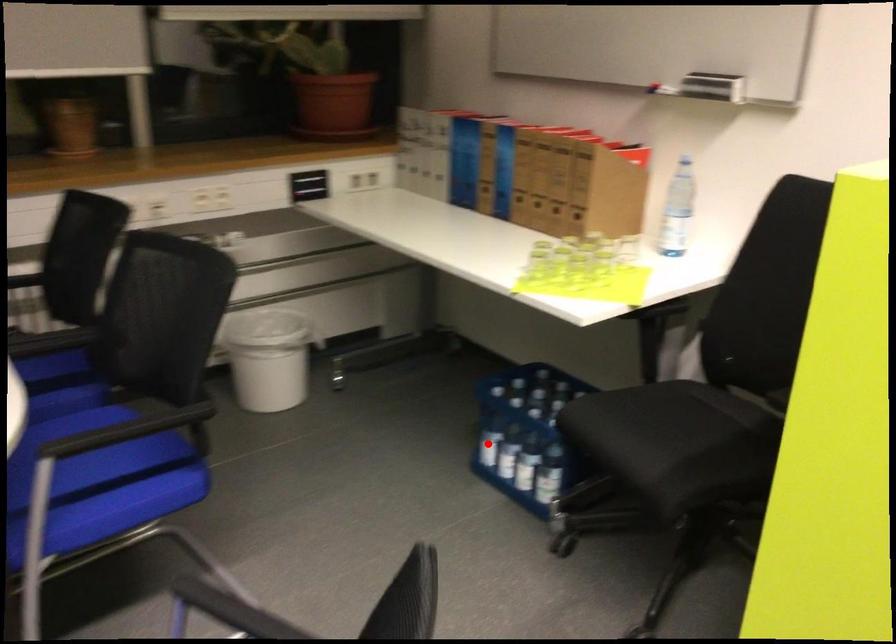
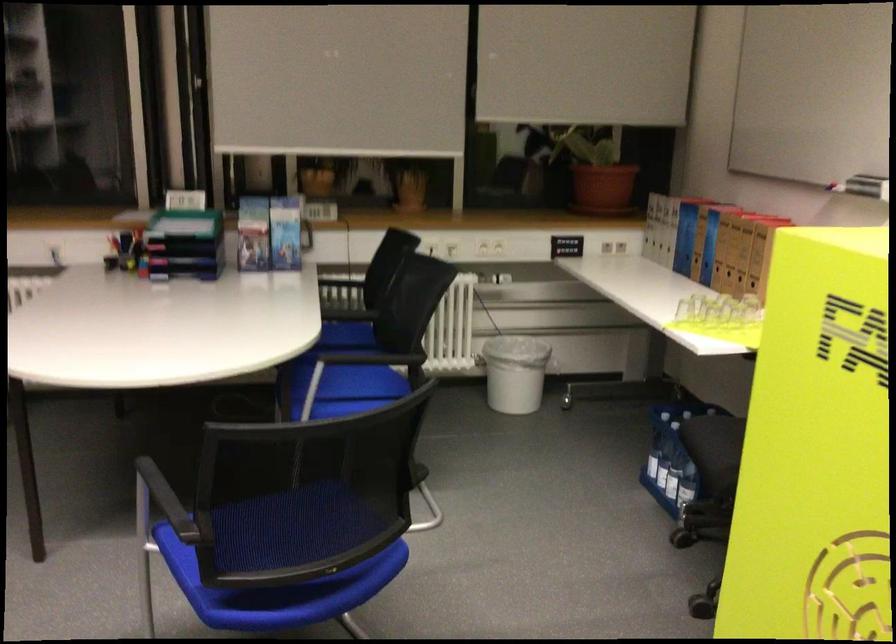
Locate, in the second image, the point that corresponds to the highlighted location in the first image.

(650, 458)